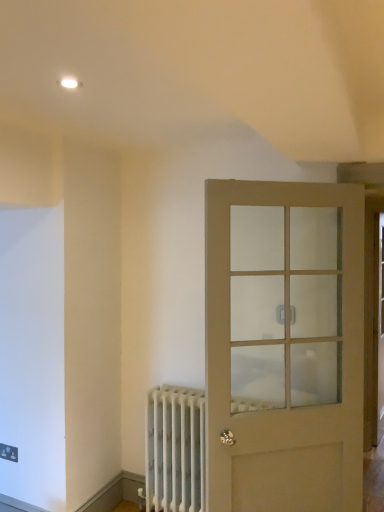
Question: In terms of size, does white metal radiator at lower left appear bigger or smaller than matte beige door at right?

Choices:
 (A) big
 (B) small

Answer: (B)

Question: From a real-world perspective, relative to matte beige door at right, is white metal radiator at lower left vertically above or below?

Choices:
 (A) below
 (B) above

Answer: (A)

Question: Based on their positions, is white metal radiator at lower left located to the left or right of matte beige door at right?

Choices:
 (A) left
 (B) right

Answer: (A)

Question: Would you say matte beige door at right is to the left or to the right of white metal radiator at lower left in the picture?

Choices:
 (A) right
 (B) left

Answer: (A)

Question: From the image's perspective, is matte beige door at right located above or below white metal radiator at lower left?

Choices:
 (A) below
 (B) above

Answer: (B)

Question: From a real-world perspective, is matte beige door at right above or below white metal radiator at lower left?

Choices:
 (A) above
 (B) below

Answer: (A)

Question: Is matte beige door at right in front of or behind white metal radiator at lower left in the image?

Choices:
 (A) behind
 (B) front

Answer: (B)